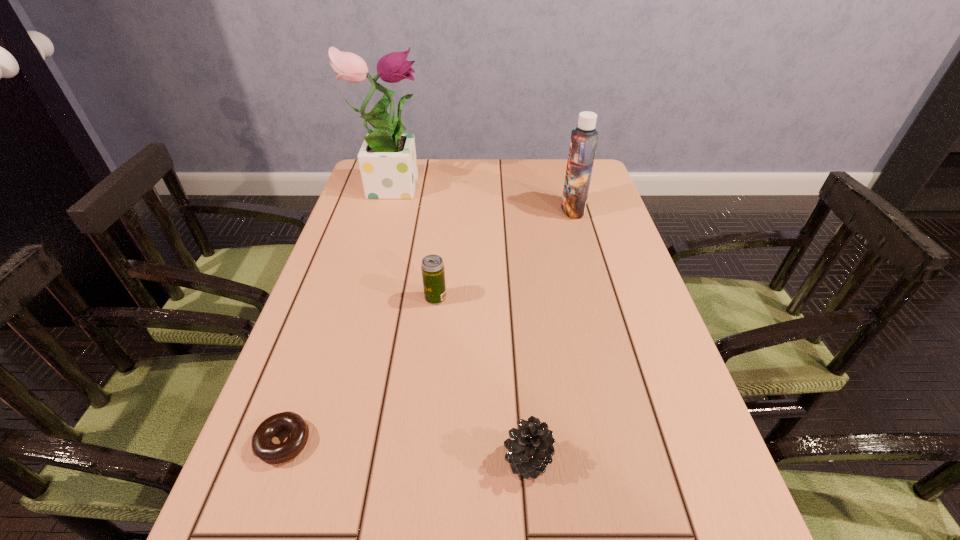
Find the location of a particular element. Image resolution: width=960 pixels, height=540 pixels. vacant position in the image that satisfies the following two spatial constraints: 1. on the front-facing side of the second object from right to left; 2. on the left side of the flower arrangement is located at coordinates (311, 459).

The image size is (960, 540). I want to click on vacant space that satisfies the following two spatial constraints: 1. on the front-facing side of the third farthest object; 2. on the right side of the tallest object, so [x=358, y=298].